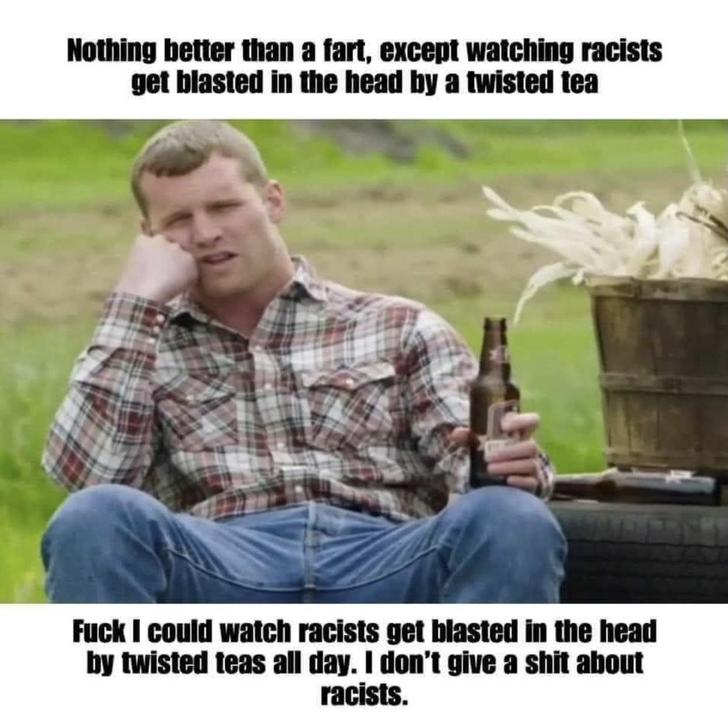
The image size is (728, 715). I want to click on bucket, so click(x=700, y=350).